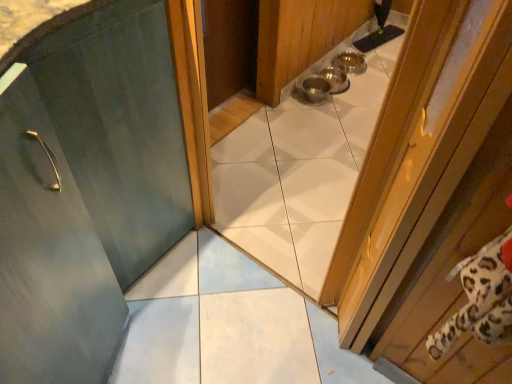
Question: Which direction should I rotate to look at matte green door at center, which appears as the 1th door when viewed from the left?

Choices:
 (A) left
 (B) right

Answer: (A)

Question: Is matte green door at center, which appears as the 1th door when viewed from the left, located outside wooden door at right, the 1th door positioned from the right?

Choices:
 (A) yes
 (B) no

Answer: (A)

Question: Considering the relative sizes of matte green door at center, which is the 2th door from right to left, and wooden door at right, the 1th door positioned from the right, in the image provided, is matte green door at center, which is the 2th door from right to left, thinner than wooden door at right, the 1th door positioned from the right,?

Choices:
 (A) no
 (B) yes

Answer: (A)

Question: Is matte green door at center, which appears as the 1th door when viewed from the left, taller than wooden door at right, the 1th door positioned from the right?

Choices:
 (A) no
 (B) yes

Answer: (B)

Question: Is the depth of matte green door at center, which is the 2th door from right to left, less than that of wooden door at right, the second door from the left?

Choices:
 (A) yes
 (B) no

Answer: (B)

Question: Is matte green door at center, which appears as the 1th door when viewed from the left, to the left of wooden door at right, the second door from the left, from the viewer's perspective?

Choices:
 (A) yes
 (B) no

Answer: (A)

Question: From a real-world perspective, is matte green door at center, which appears as the 1th door when viewed from the left, over wooden door at right, the 1th door positioned from the right?

Choices:
 (A) yes
 (B) no

Answer: (B)

Question: Is wooden door at right, the second door from the left, completely or partially outside of matte green door at center, which appears as the 1th door when viewed from the left?

Choices:
 (A) no
 (B) yes

Answer: (B)

Question: Can matte green door at center, which is the 2th door from right to left, be found inside wooden door at right, the 1th door positioned from the right?

Choices:
 (A) no
 (B) yes

Answer: (A)

Question: Can you confirm if wooden door at right, the second door from the left, is bigger than matte green door at center, which appears as the 1th door when viewed from the left?

Choices:
 (A) yes
 (B) no

Answer: (B)

Question: Is wooden door at right, the second door from the left, with matte green door at center, which is the 2th door from right to left?

Choices:
 (A) yes
 (B) no

Answer: (B)

Question: From the image's perspective, is wooden door at right, the second door from the left, located beneath matte green door at center, which is the 2th door from right to left?

Choices:
 (A) no
 (B) yes

Answer: (B)

Question: Considering the relative sizes of wooden door at right, the second door from the left, and matte green door at center, which is the 2th door from right to left, in the image provided, is wooden door at right, the second door from the left, wider than matte green door at center, which is the 2th door from right to left,?

Choices:
 (A) yes
 (B) no

Answer: (B)

Question: Considering the relative positions of wooden door at right, the second door from the left, and matte green door at center, which appears as the 1th door when viewed from the left, in the image provided, is wooden door at right, the second door from the left, to the left or to the right of matte green door at center, which appears as the 1th door when viewed from the left,?

Choices:
 (A) right
 (B) left

Answer: (A)